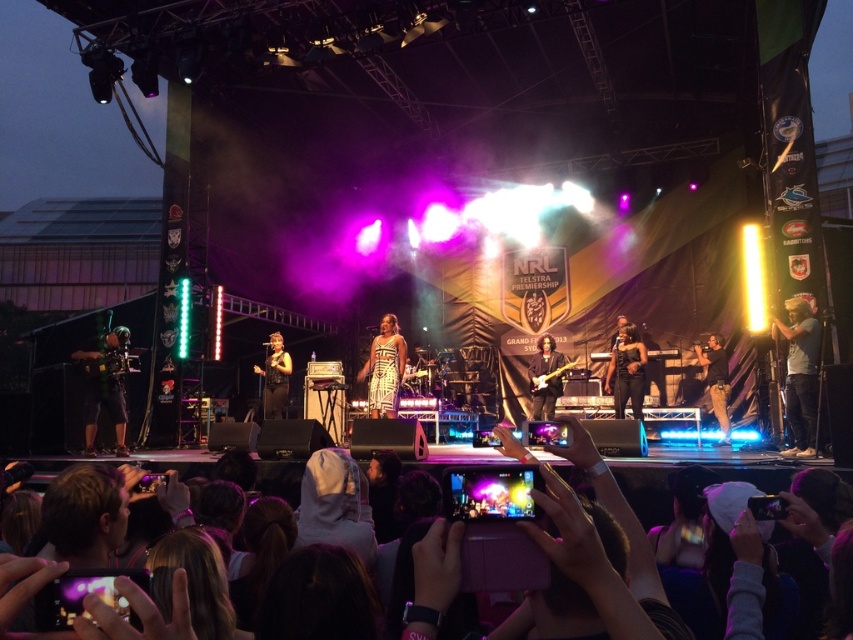
Who is taller, white printed dress at center or matte black microphone at center?

matte black microphone at center is taller.

Can you confirm if white printed dress at center is thinner than matte black microphone at center?

Yes, white printed dress at center is thinner than matte black microphone at center.

The width and height of the screenshot is (853, 640). Describe the element at coordinates (384, 369) in the screenshot. I see `white printed dress at center` at that location.

At what (x,y) coordinates should I click in order to perform the action: click on white printed dress at center. Please return your answer as a coordinate pair (x, y). Looking at the image, I should click on (384, 369).

Is black leather guitar at center shorter than matte black microphone at center?

Yes.

Which is behind, point (546, 401) or point (271, 362)?

Positioned behind is point (271, 362).

Is point (564, 356) behind point (265, 381)?

No.

Where is `black leather guitar at center`? Image resolution: width=853 pixels, height=640 pixels. black leather guitar at center is located at coordinates (544, 378).

Which is more to the left, white cotton shirt at right or black leather guitar at center?

black leather guitar at center is more to the left.

Is point (809, 339) positioned in front of point (541, 349)?

Yes.

This screenshot has width=853, height=640. What do you see at coordinates (799, 374) in the screenshot?
I see `white cotton shirt at right` at bounding box center [799, 374].

What are the coordinates of `white cotton shirt at right` in the screenshot? It's located at (799, 374).